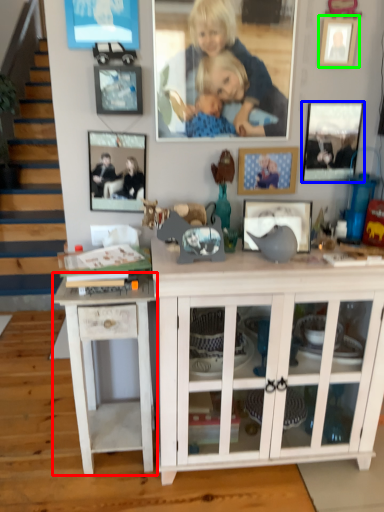
Question: Which is farther away from table (highlighted by a red box)? picture frame (highlighted by a blue box) or picture frame (highlighted by a green box)?

Choices:
 (A) picture frame
 (B) picture frame

Answer: (B)